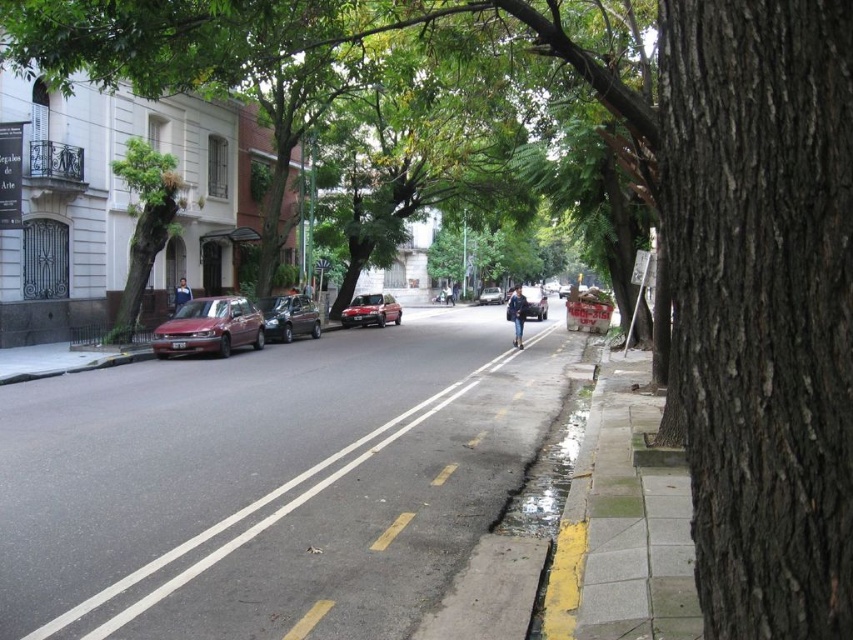
This screenshot has height=640, width=853. In order to click on asphalt at center in this screenshot , I will do `click(265, 481)`.

Looking at this image, is asphalt at center bigger than dark brown textured bark at right?

Yes, asphalt at center is bigger than dark brown textured bark at right.

Is point (65, 531) less distant than point (759, 113)?

No, it is not.

Identify the location of asphalt at center. The width and height of the screenshot is (853, 640). (265, 481).

Can you confirm if matte red car at center-left is bigger than matte red car at center?

No.

Which is more to the right, matte red car at center-left or matte red car at center?

matte red car at center

The width and height of the screenshot is (853, 640). What are the coordinates of `matte red car at center-left` in the screenshot? It's located at (209, 326).

The height and width of the screenshot is (640, 853). Find the location of `matte red car at center-left`. matte red car at center-left is located at coordinates (209, 326).

Can you confirm if dark brown textured bark at right is taller than matte red car at center?

Correct, dark brown textured bark at right is much taller as matte red car at center.

Image resolution: width=853 pixels, height=640 pixels. What do you see at coordinates (762, 305) in the screenshot?
I see `dark brown textured bark at right` at bounding box center [762, 305].

Locate an element on the screen. dark brown textured bark at right is located at coordinates (762, 305).